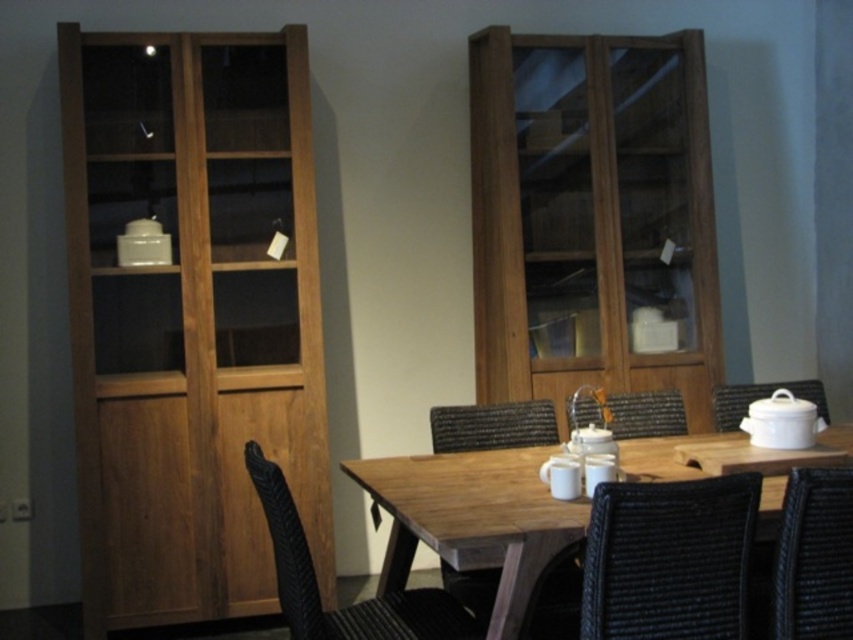
You are standing at the entrance of the dining area and want to reach the point marked as point [836,634]. However, there is an obstacle at point [473,586]. Can you walk straight towards your destination without going around the obstacle?

Since point [836,634] is in front of point [473,586], you would have to go around the obstacle at point [473,586] to reach your destination.

You are planning to place a new rectangular side table in the dining area. The table must be positioned between the black woven chair at center and the tall, narrow wooden cabinet on the left. Given that the cabinet is at point 0.0 and the chair is at 0.945 on the horizontal axis, will there be enough space for a 0.5 units wide table?

The distance between the black woven chair at center and the tall, narrow wooden cabinet on the left is 0.945 units. Since the table requires 0.5 units of space, there is sufficient room to place it between them.